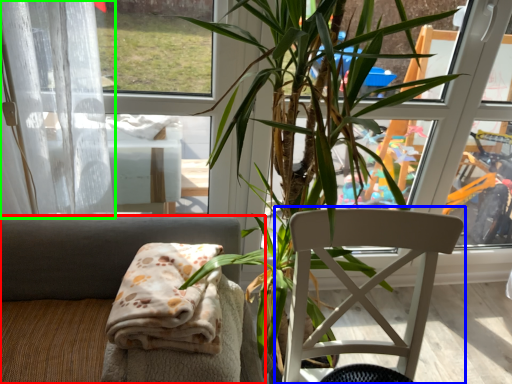
Question: Which is farther away from chair (highlighted by a red box)? chair (highlighted by a blue box) or curtain (highlighted by a green box)?

Choices:
 (A) chair
 (B) curtain

Answer: (A)